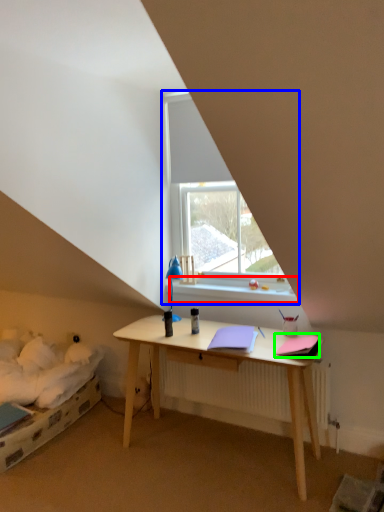
Question: Considering the real-world distances, which object is closest to window sill (highlighted by a red box)? window (highlighted by a blue box) or notebook (highlighted by a green box).

Choices:
 (A) window
 (B) notebook

Answer: (A)